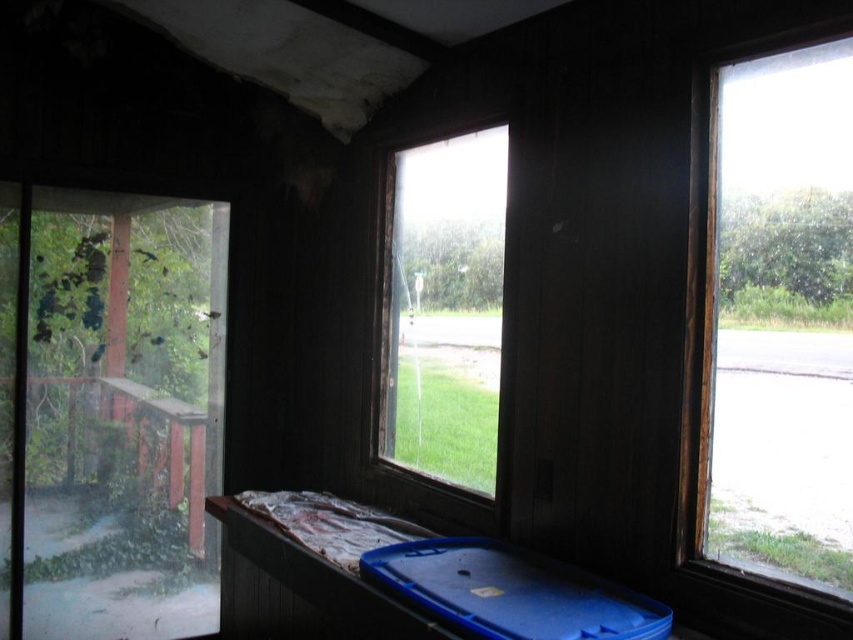
Question: Observing the image, what is the correct spatial positioning of clear glass window at right in reference to clear glass window at center?

Choices:
 (A) right
 (B) left

Answer: (A)

Question: Which object appears farthest from the camera in this image?

Choices:
 (A) clear glass window at center
 (B) blue plastic tray at lower center
 (C) clear glass window at right

Answer: (A)

Question: Which object appears closest to the camera in this image?

Choices:
 (A) clear glass window at center
 (B) blue plastic tray at lower center
 (C) clear glass window at right

Answer: (C)

Question: Is clear glass window at center positioned at the back of blue plastic tray at lower center?

Choices:
 (A) yes
 (B) no

Answer: (A)

Question: Which point is farther from the camera taking this photo?

Choices:
 (A) (767, 536)
 (B) (469, 273)

Answer: (B)

Question: Is clear glass window at right to the left of blue plastic tray at lower center from the viewer's perspective?

Choices:
 (A) yes
 (B) no

Answer: (B)